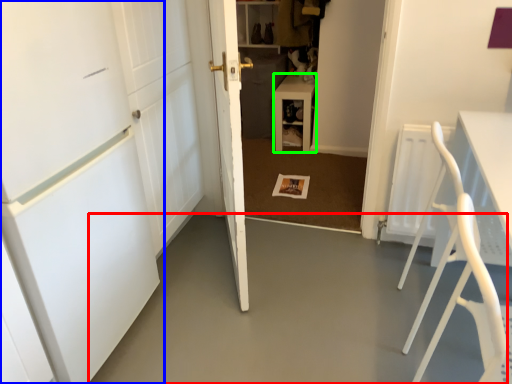
Question: Which object is positioned closest to concrete (highlighted by a red box)? Select from door (highlighted by a blue box) and furniture (highlighted by a green box).

Choices:
 (A) door
 (B) furniture

Answer: (A)